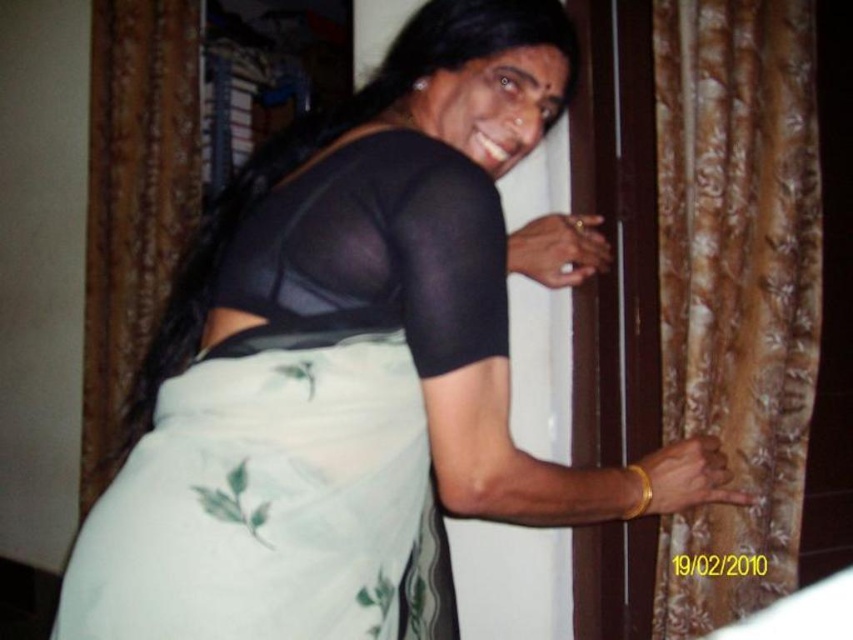
Question: Which point is closer to the camera?

Choices:
 (A) (788, 124)
 (B) (416, 442)

Answer: (B)

Question: Considering the relative positions of white sheer fabric dress at center and brown textured curtain at left in the image provided, where is white sheer fabric dress at center located with respect to brown textured curtain at left?

Choices:
 (A) below
 (B) above

Answer: (A)

Question: Is white sheer fabric dress at center smaller than gold floral fabric curtain at right?

Choices:
 (A) no
 (B) yes

Answer: (A)

Question: Which point appears closest to the camera in this image?

Choices:
 (A) (201, 540)
 (B) (727, 417)
 (C) (173, 58)

Answer: (A)

Question: Which point appears closest to the camera in this image?

Choices:
 (A) (769, 381)
 (B) (134, 218)
 (C) (322, 198)

Answer: (C)

Question: Does white sheer fabric dress at center appear over gold floral fabric curtain at right?

Choices:
 (A) yes
 (B) no

Answer: (B)